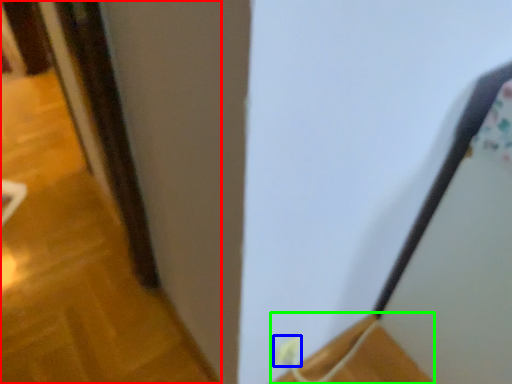
Question: Based on their relative distances, which object is farther from door (highlighted by a red box)? Choose from electric outlet (highlighted by a blue box) and wood (highlighted by a green box).

Choices:
 (A) electric outlet
 (B) wood

Answer: (A)